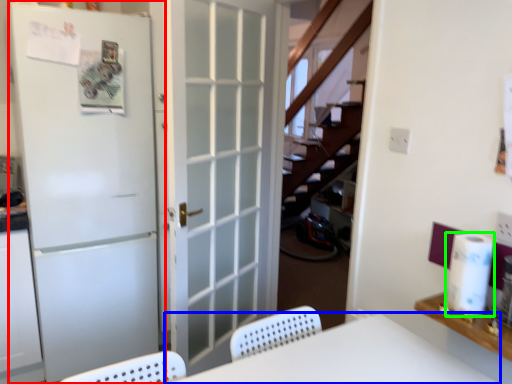
Question: Considering the real-world distances, which object is farthest from door (highlighted by a red box)? furniture (highlighted by a blue box) or paper towel (highlighted by a green box)?

Choices:
 (A) furniture
 (B) paper towel

Answer: (B)